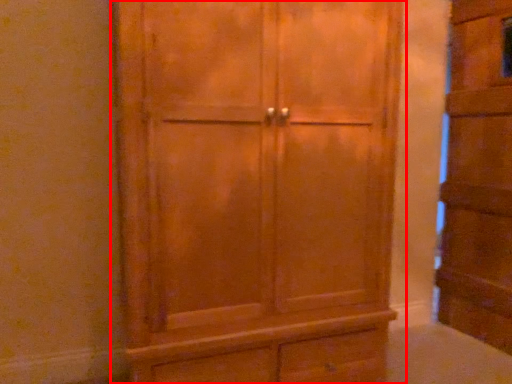
Question: Considering the relative positions of cupboard (annotated by the red box) and cupboard in the image provided, where is cupboard (annotated by the red box) located with respect to the staircase?

Choices:
 (A) right
 (B) left

Answer: (B)